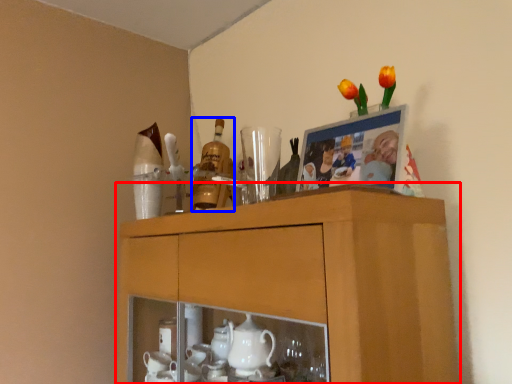
Question: Which object is further to the camera taking this photo, cabinetry (highlighted by a red box) or bottle (highlighted by a blue box)?

Choices:
 (A) cabinetry
 (B) bottle

Answer: (B)